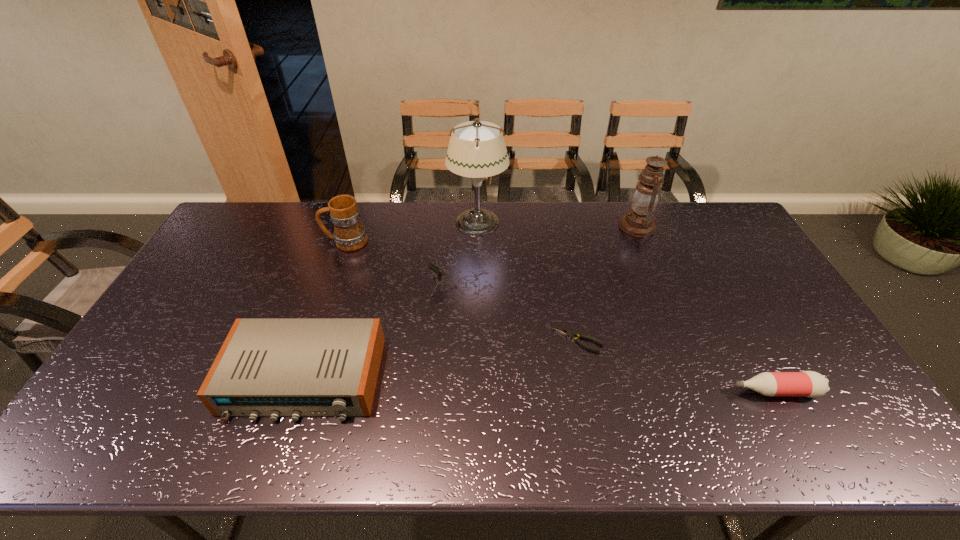
The height and width of the screenshot is (540, 960). I want to click on free point located 0.330m on the side of the third tallest object with the handle, so click(x=228, y=242).

I want to click on vacant space located 0.330m on the side of the third tallest object with the handle, so click(x=228, y=242).

Identify the location of vacant position located on the side of the third tallest object with the handle. This screenshot has width=960, height=540. (289, 242).

Find the location of `vacant space positioned on the stand of the microphone`. vacant space positioned on the stand of the microphone is located at coordinates (518, 287).

The width and height of the screenshot is (960, 540). I want to click on vacant space located 0.060m on the front panel of the radio receiver, so click(281, 448).

Where is `vacant space situated with the cap open on the second shortest object`? This screenshot has height=540, width=960. vacant space situated with the cap open on the second shortest object is located at coordinates (573, 392).

You are a GUI agent. You are given a task and a screenshot of the screen. Output one action in this format:
    pyautogui.click(x=<x>, y=<y>)
    Task: Click on the free space located with the cap open on the second shortest object
    The image size is (960, 540).
    Given the screenshot: What is the action you would take?
    624,392

The height and width of the screenshot is (540, 960). In order to click on free location located with the cap open on the second shortest object in this screenshot , I will do `click(668, 392)`.

Where is `vacant space located on the back of the fifth object from left to right`? The height and width of the screenshot is (540, 960). vacant space located on the back of the fifth object from left to right is located at coordinates (572, 314).

I want to click on lampshade that is at the far edge, so click(477, 149).